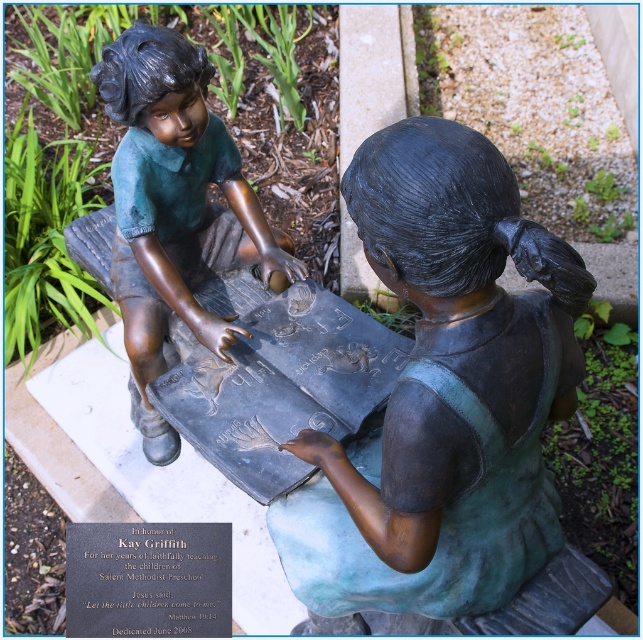
You are standing in front of the bronze sculpture of two children. There are two points marked on the sculpture. The first point is at coordinates point (527, 316) and the second point is at point (123, 252). Which point is closer to you?

Point (527, 316) is closer to the viewer than point (123, 252).

You are an art curator planning to install these two bronze statues in a gallery. The minimum required distance between any two displayed artworks is 30 inches for safety. Given the current distance between the green patina bronze statue at center and the bronze statue at upper left, will they meet the safety requirement?

The green patina bronze statue at center is 26.96 inches from the bronze statue at upper left. Since 26.96 inches is less than the required 30 inches, they do not meet the safety requirement.

You are an art student standing in front of the green patina bronze statue at center and the bronze statue at upper left. Which statue would you need to look up to see?

The bronze statue at upper left is further away from you than the green patina bronze statue at center, so you would need to look up to see the bronze statue at upper left.